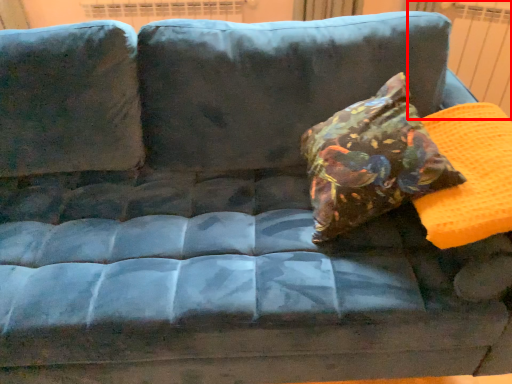
Question: From the image's perspective, what is the correct spatial relationship of radiator (annotated by the red box) in relation to throw pillow?

Choices:
 (A) above
 (B) below

Answer: (A)